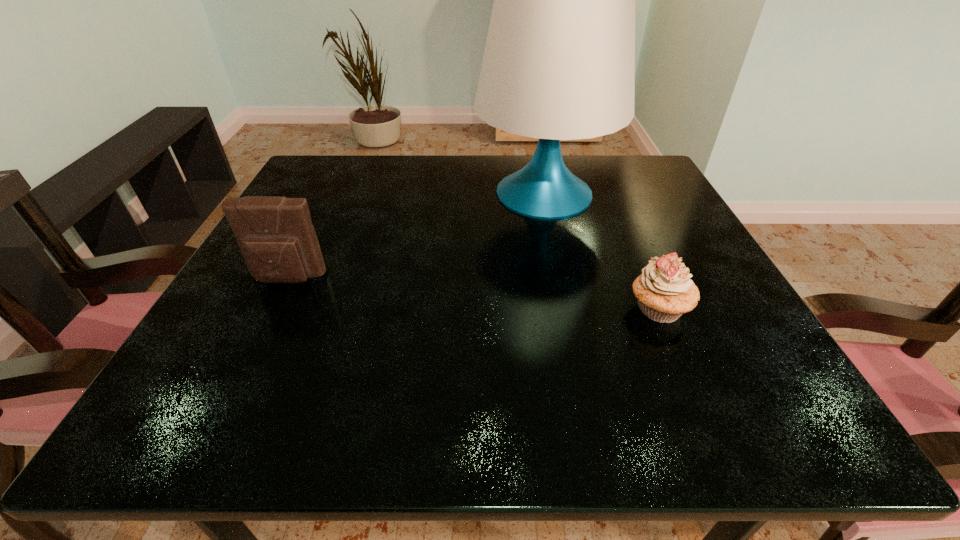
I want to click on free point between the leftmost object and the nearest object, so click(x=473, y=294).

At what (x,y) coordinates should I click in order to perform the action: click on unoccupied area between the shortest object and the pouch. Please return your answer as a coordinate pair (x, y). Image resolution: width=960 pixels, height=540 pixels. Looking at the image, I should click on (473, 294).

Identify the location of object that is the second nearest to the second nearest object. pos(664,291).

This screenshot has height=540, width=960. In order to click on object that can be found as the second closest to the second shortest object in this screenshot , I will do `click(664, 291)`.

Where is `vacant space that satisfies the following two spatial constraints: 1. on the front-facing side of the cupcake; 2. on the right side of the table lamp`? The width and height of the screenshot is (960, 540). vacant space that satisfies the following two spatial constraints: 1. on the front-facing side of the cupcake; 2. on the right side of the table lamp is located at coordinates (568, 309).

Identify the location of vacant space that satisfies the following two spatial constraints: 1. on the front-facing side of the table lamp; 2. with an open flap on the second nearest object. (562, 279).

Locate an element on the screen. Image resolution: width=960 pixels, height=540 pixels. vacant area in the image that satisfies the following two spatial constraints: 1. on the front-facing side of the tallest object; 2. with an open flap on the second shortest object is located at coordinates (562, 279).

Locate an element on the screen. The width and height of the screenshot is (960, 540). vacant region that satisfies the following two spatial constraints: 1. with an open flap on the cupcake; 2. on the right side of the leftmost object is located at coordinates (273, 309).

At what (x,y) coordinates should I click in order to perform the action: click on free region that satisfies the following two spatial constraints: 1. with an open flap on the second tallest object; 2. on the right side of the cupcake. Please return your answer as a coordinate pair (x, y). Image resolution: width=960 pixels, height=540 pixels. Looking at the image, I should click on (273, 309).

This screenshot has width=960, height=540. In order to click on free spot that satisfies the following two spatial constraints: 1. on the front-facing side of the table lamp; 2. with an open flap on the leftmost object in this screenshot , I will do `click(562, 279)`.